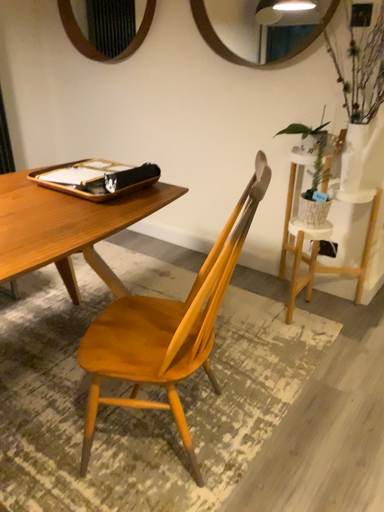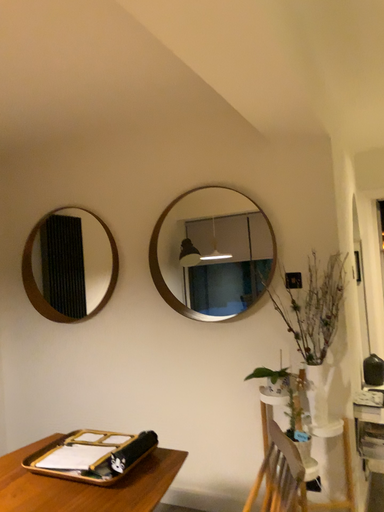
Question: Which way did the camera rotate in the video?

Choices:
 (A) rotated right
 (B) rotated left

Answer: (A)